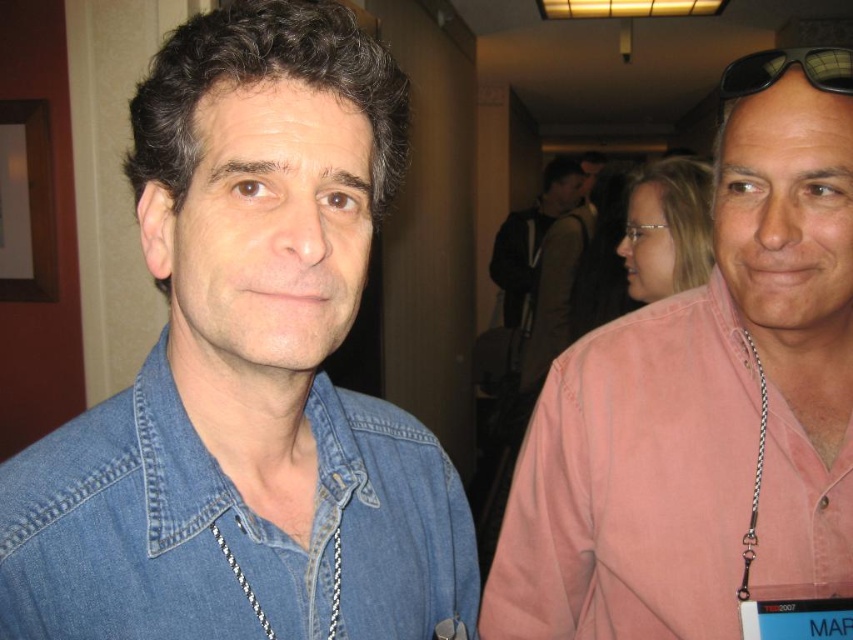
Does pink cotton shirt at right appear under white braided cord at right?

Incorrect, pink cotton shirt at right is not positioned below white braided cord at right.

Is pink cotton shirt at right above white braided cord at right?

Indeed, pink cotton shirt at right is positioned over white braided cord at right.

You are a GUI agent. You are given a task and a screenshot of the screen. Output one action in this format:
    pyautogui.click(x=<x>, y=<y>)
    Task: Click on the pink cotton shirt at right
    The height and width of the screenshot is (640, 853).
    Given the screenshot: What is the action you would take?
    pyautogui.click(x=705, y=419)

Where is `pink cotton shirt at right`? The width and height of the screenshot is (853, 640). pink cotton shirt at right is located at coordinates (705, 419).

Does point (770, 52) come in front of point (213, 525)?

No.

Can you confirm if black plastic sunglasses at upper right is bigger than silver chain necklace at center?

Yes.

Identify the location of black plastic sunglasses at upper right. This screenshot has width=853, height=640. (787, 68).

The image size is (853, 640). I want to click on black plastic sunglasses at upper right, so click(x=787, y=68).

From the picture: Is pink cotton shirt at right taller than silver chain necklace at center?

Yes.

Image resolution: width=853 pixels, height=640 pixels. What are the coordinates of `pink cotton shirt at right` in the screenshot? It's located at (705, 419).

Who is more distant from viewer, (x=822, y=164) or (x=265, y=620)?

The point (x=822, y=164) is behind.

Where is `pink cotton shirt at right`? This screenshot has width=853, height=640. pink cotton shirt at right is located at coordinates pos(705,419).